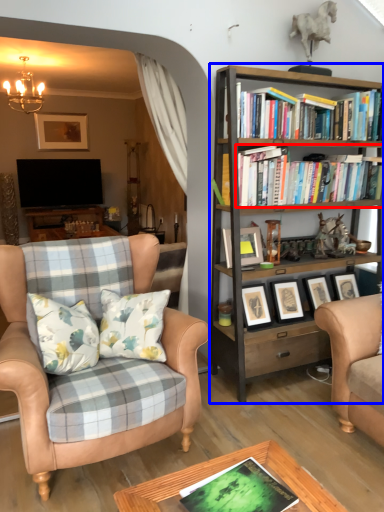
Question: Which object is further to the camera taking this photo, book (highlighted by a red box) or bookcase (highlighted by a blue box)?

Choices:
 (A) book
 (B) bookcase

Answer: (A)